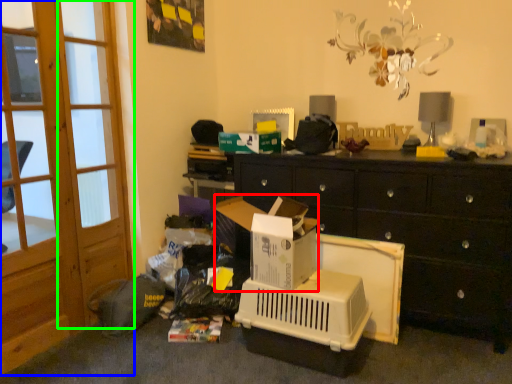
Question: Estimate the real-world distances between objects in this image. Which object is farther from cardboard box (highlighted by a red box), screen door (highlighted by a blue box) or screen door (highlighted by a green box)?

Choices:
 (A) screen door
 (B) screen door

Answer: (B)